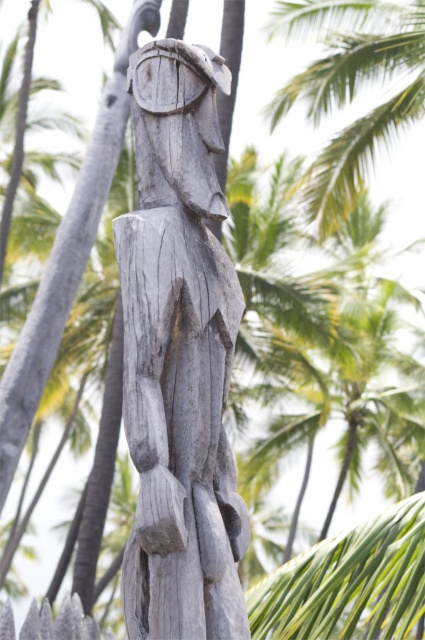
Question: Where is gray wood carving at center located in relation to green leafy palm tree at upper center in the image?

Choices:
 (A) above
 (B) below

Answer: (B)

Question: Is gray wood carving at center to the left of green leafy palm tree at upper center from the viewer's perspective?

Choices:
 (A) yes
 (B) no

Answer: (A)

Question: Which point is farther from the camera taking this photo?

Choices:
 (A) (150, 465)
 (B) (316, 60)

Answer: (B)

Question: Which point is farther from the camera taking this photo?

Choices:
 (A) (314, 76)
 (B) (166, 84)

Answer: (A)

Question: Is gray wood carving at center closer to the viewer compared to green leafy palm tree at upper center?

Choices:
 (A) no
 (B) yes

Answer: (B)